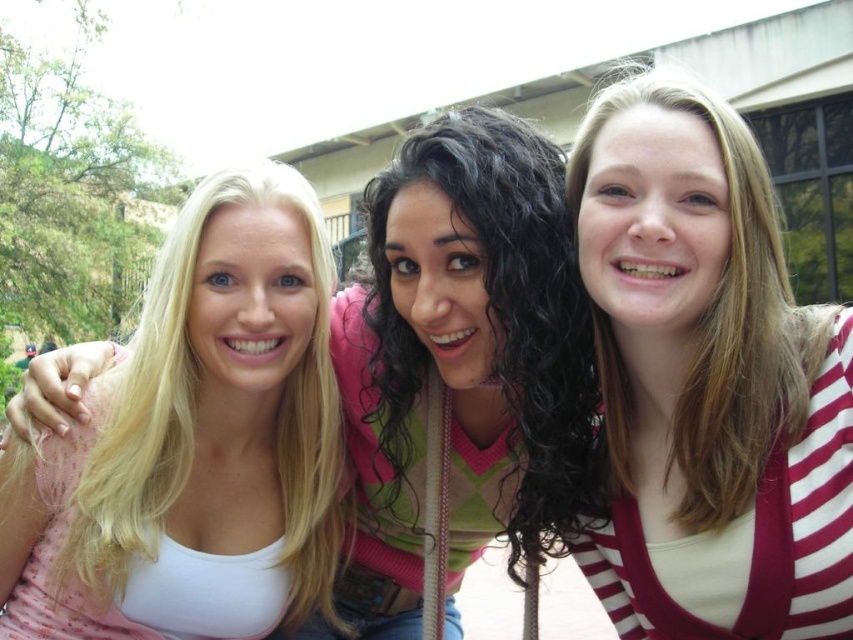
Question: From the image, what is the correct spatial relationship of white striped cardigan at center in relation to blonde hair at left?

Choices:
 (A) right
 (B) left

Answer: (A)

Question: Does white striped cardigan at center appear on the left side of blonde hair at left?

Choices:
 (A) yes
 (B) no

Answer: (B)

Question: Which object is closer to the camera taking this photo?

Choices:
 (A) blonde hair at left
 (B) white striped cardigan at center

Answer: (B)

Question: Is white striped cardigan at center smaller than blonde hair at left?

Choices:
 (A) no
 (B) yes

Answer: (A)

Question: Which point appears farthest from the camera in this image?

Choices:
 (A) (247, 304)
 (B) (750, 141)

Answer: (A)

Question: Which point is closer to the camera?

Choices:
 (A) (283, 324)
 (B) (584, 228)

Answer: (B)